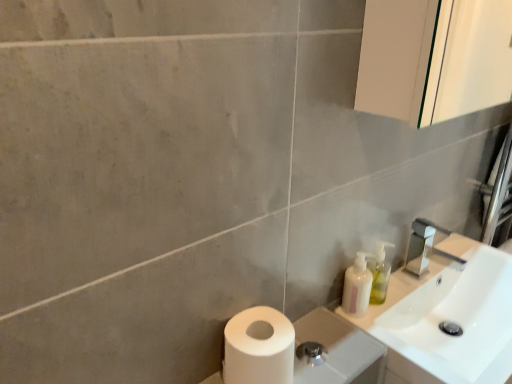
What are the coordinates of `white matte toilet paper at lower left` in the screenshot? It's located at (335, 348).

The image size is (512, 384). What do you see at coordinates (335, 348) in the screenshot?
I see `white matte toilet paper at lower left` at bounding box center [335, 348].

I want to click on white glossy sink at upper right, so click(x=448, y=308).

At what (x,y) coordinates should I click in order to perform the action: click on white matte toilet paper at lower left. Please return your answer as a coordinate pair (x, y). Looking at the image, I should click on click(x=258, y=347).

The height and width of the screenshot is (384, 512). Find the location of `white matte toilet paper at lower left`. white matte toilet paper at lower left is located at coordinates pyautogui.click(x=335, y=348).

Identify the location of soap dispenser on the right of white matte toilet paper at lower left. The image size is (512, 384). (380, 274).

Could you tell me if translucent plastic soap dispenser at right is facing white matte toilet paper at lower left?

No.

Looking at this image, is translucent plastic soap dispenser at right at the left side of white matte toilet paper at lower left?

Incorrect, translucent plastic soap dispenser at right is not on the left side of white matte toilet paper at lower left.

Is translucent plastic soap dispenser at right next to white matte toilet paper at lower left and touching it?

translucent plastic soap dispenser at right and white matte toilet paper at lower left are clearly separated.

Does white glossy sink at upper right have a greater height compared to translucent plastic soap dispenser at right?

Yes, white glossy sink at upper right is taller than translucent plastic soap dispenser at right.

Which of these two, white glossy sink at upper right or translucent plastic soap dispenser at right, is bigger?

With larger size is white glossy sink at upper right.

From the image's perspective, which object appears higher, white glossy sink at upper right or translucent plastic soap dispenser at right?

translucent plastic soap dispenser at right.

Considering the positions of objects white glossy sink at upper right and translucent plastic soap dispenser at right in the image provided, who is in front, white glossy sink at upper right or translucent plastic soap dispenser at right?

white glossy sink at upper right is closer to the camera.

Between white matte toilet paper at lower left and white matte toilet paper at lower left, which one appears on the left side from the viewer's perspective?

From the viewer's perspective, white matte toilet paper at lower left appears more on the left side.

Is white matte toilet paper at lower left facing away from white matte toilet paper at lower left?

That's not correct — white matte toilet paper at lower left is not looking away from white matte toilet paper at lower left.

Is white matte toilet paper at lower left closer to camera compared to white matte toilet paper at lower left?

No.

At what (x,y) coordinates should I click in order to perform the action: click on porcelain on the left of translucent plastic soap dispenser at right. Please return your answer as a coordinate pair (x, y). This screenshot has width=512, height=384. Looking at the image, I should click on (335, 348).

Consider the image. Which of these two, translucent plastic soap dispenser at right or white matte toilet paper at lower left, is wider?

With larger width is white matte toilet paper at lower left.

Does point (359, 291) lie in front of point (354, 355)?

No, it is not.

From the image's perspective, is translucent plastic soap dispenser at right positioned above or below white matte toilet paper at lower left?

Based on their image positions, translucent plastic soap dispenser at right is located above white matte toilet paper at lower left.

From the image's perspective, which object appears higher, white matte toilet paper at lower left or translucent plastic soap dispenser at right?

translucent plastic soap dispenser at right, from the image's perspective.

Can you tell me how much white matte toilet paper at lower left and translucent plastic soap dispenser at right differ in facing direction?

The angle between the facing direction of white matte toilet paper at lower left and the facing direction of translucent plastic soap dispenser at right is 6.1 degrees.

This screenshot has height=384, width=512. I want to click on toilet paper on the left of translucent plastic soap dispenser at right, so click(258, 347).

Does white matte toilet paper at lower left have a lesser height compared to translucent plastic soap dispenser at right?

Yes, white matte toilet paper at lower left is shorter than translucent plastic soap dispenser at right.

In the scene shown: Is translucent plastic soap dispenser at right oriented towards translucent plastic soap dispenser at right?

No, translucent plastic soap dispenser at right is not oriented towards translucent plastic soap dispenser at right.

Does translucent plastic soap dispenser at right come in front of translucent plastic soap dispenser at right?

That is False.

What's the angular difference between translucent plastic soap dispenser at right and translucent plastic soap dispenser at right's facing directions?

There is a 4.41-degree angle between the facing directions of translucent plastic soap dispenser at right and translucent plastic soap dispenser at right.

Between translucent plastic soap dispenser at right and translucent plastic soap dispenser at right, which one has more height?

With more height is translucent plastic soap dispenser at right.

Considering the relative sizes of translucent plastic soap dispenser at right and white glossy sink at upper right in the image provided, is translucent plastic soap dispenser at right thinner than white glossy sink at upper right?

Yes.

This screenshot has width=512, height=384. In order to click on sink below the translucent plastic soap dispenser at right (from a real-world perspective) in this screenshot , I will do `click(448, 308)`.

Is translucent plastic soap dispenser at right positioned beyond the bounds of white glossy sink at upper right?

No, translucent plastic soap dispenser at right is inside or overlapping with white glossy sink at upper right.

Based on the photo, which is behind, translucent plastic soap dispenser at right or white glossy sink at upper right?

Positioned behind is translucent plastic soap dispenser at right.

Locate an element on the screen. soap dispenser on the right of white matte toilet paper at lower left is located at coordinates (380, 274).

Identify the location of sink in front of the translucent plastic soap dispenser at right. [x=448, y=308].

Which object lies nearer to the anchor point translucent plastic soap dispenser at right, translucent plastic soap dispenser at right or white matte toilet paper at lower left?

translucent plastic soap dispenser at right is positioned closer to the anchor translucent plastic soap dispenser at right.

From the image, which object appears to be farther from white matte toilet paper at lower left, translucent plastic soap dispenser at right or translucent plastic soap dispenser at right?

translucent plastic soap dispenser at right is positioned further to the anchor white matte toilet paper at lower left.

Looking at the image, which one is located closer to translucent plastic soap dispenser at right, translucent plastic soap dispenser at right or white matte toilet paper at lower left?

translucent plastic soap dispenser at right lies closer to translucent plastic soap dispenser at right than the other object.

Looking at this image, estimate the real-world distances between objects in this image. Which object is closer to translucent plastic soap dispenser at right, white matte toilet paper at lower left or translucent plastic soap dispenser at right?

translucent plastic soap dispenser at right is positioned closer to the anchor translucent plastic soap dispenser at right.

Estimate the real-world distances between objects in this image. Which object is further from white glossy sink at upper right, white matte toilet paper at lower left or translucent plastic soap dispenser at right?

white matte toilet paper at lower left.

Considering their positions, is white glossy sink at upper right positioned closer to white matte toilet paper at lower left than translucent plastic soap dispenser at right?

Based on the image, translucent plastic soap dispenser at right appears to be nearer to white matte toilet paper at lower left.

Looking at the image, which one is located closer to white glossy sink at upper right, translucent plastic soap dispenser at right or white matte toilet paper at lower left?

translucent plastic soap dispenser at right is closer to white glossy sink at upper right.

From the image, which object appears to be nearer to white glossy sink at upper right, translucent plastic soap dispenser at right or white matte toilet paper at lower left?

The object closer to white glossy sink at upper right is translucent plastic soap dispenser at right.

You are a GUI agent. You are given a task and a screenshot of the screen. Output one action in this format:
    pyautogui.click(x=<x>, y=<y>)
    Task: Click on the soap dispenser between white matte toilet paper at lower left and white glossy sink at upper right in the horizontal direction
    This screenshot has height=384, width=512.
    Given the screenshot: What is the action you would take?
    pyautogui.click(x=380, y=274)

Find the location of a particular element. This screenshot has width=512, height=384. toiletry between white matte toilet paper at lower left and translucent plastic soap dispenser at right from front to back is located at coordinates (357, 286).

Where is `soap dispenser situated between translucent plastic soap dispenser at right and white glossy sink at upper right from left to right`? soap dispenser situated between translucent plastic soap dispenser at right and white glossy sink at upper right from left to right is located at coordinates (380, 274).

Find the location of a particular element. toilet paper between white matte toilet paper at lower left and translucent plastic soap dispenser at right in the front-back direction is located at coordinates (258, 347).